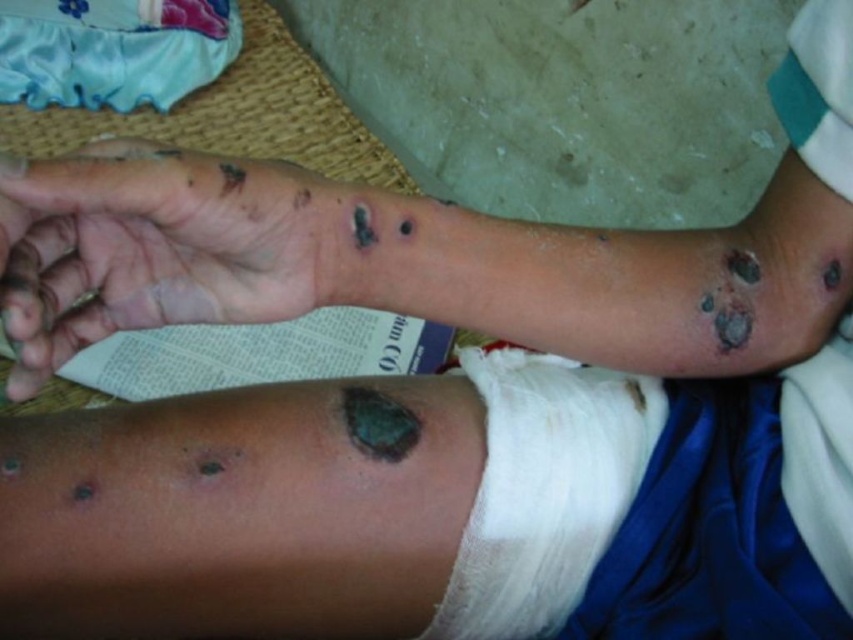
You are a medical professional assessing the injuries on the arm. You notice two points of interest marked on the skin at coordinates point (141, 273) and point (566, 516). From the perspective of someone looking at the arm, which point is closer to you?

Point (141, 273) is in front of point (566, 516), so it is closer to you.